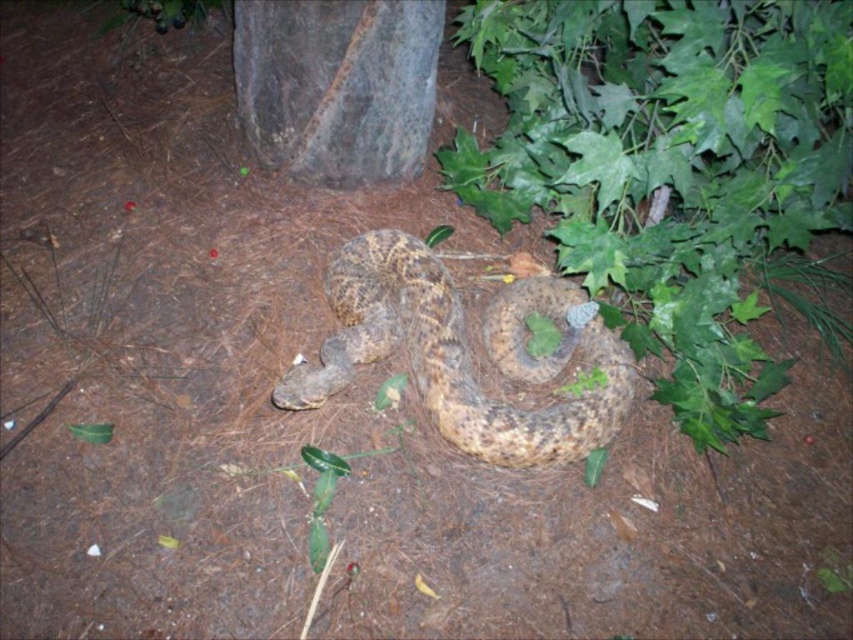
Question: Does camouflage-patterned snake at center have a lesser width compared to rusty metal tree trunk at center?

Choices:
 (A) no
 (B) yes

Answer: (A)

Question: Estimate the real-world distances between objects in this image. Which object is farther from the rusty metal tree trunk at center?

Choices:
 (A) green leafy plant at center
 (B) camouflage-patterned snake at center

Answer: (A)

Question: Where is green leafy plant at center located in relation to rusty metal tree trunk at center in the image?

Choices:
 (A) below
 (B) above

Answer: (A)

Question: Based on their relative distances, which object is farther from the green leafy plant at center?

Choices:
 (A) rusty metal tree trunk at center
 (B) camouflage-patterned snake at center

Answer: (A)

Question: Based on their relative distances, which object is nearer to the green leafy plant at center?

Choices:
 (A) camouflage-patterned snake at center
 (B) rusty metal tree trunk at center

Answer: (A)

Question: Can you confirm if green leafy plant at center is positioned above camouflage-patterned snake at center?

Choices:
 (A) yes
 (B) no

Answer: (A)